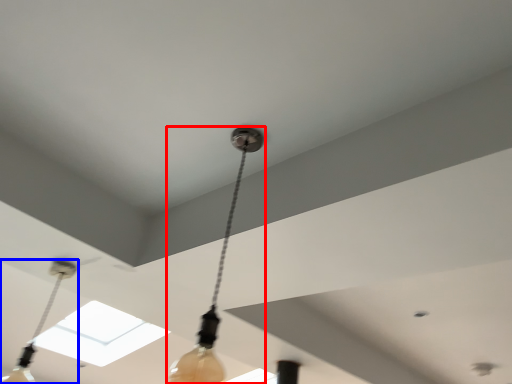
Question: Which of the following is the closest to the observer, lamp (highlighted by a red box) or lamp (highlighted by a blue box)?

Choices:
 (A) lamp
 (B) lamp

Answer: (A)